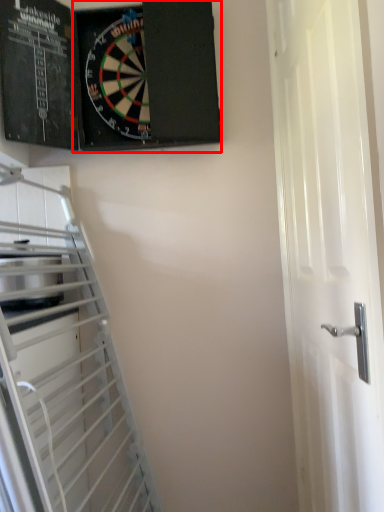
Question: In this image, where is bulletin board (annotated by the red box) located relative to door?

Choices:
 (A) left
 (B) right

Answer: (A)